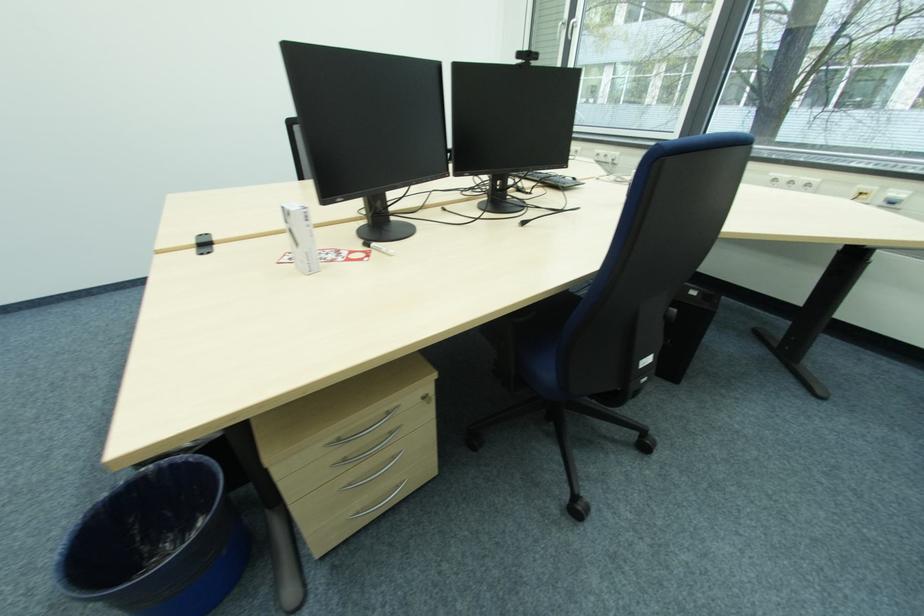
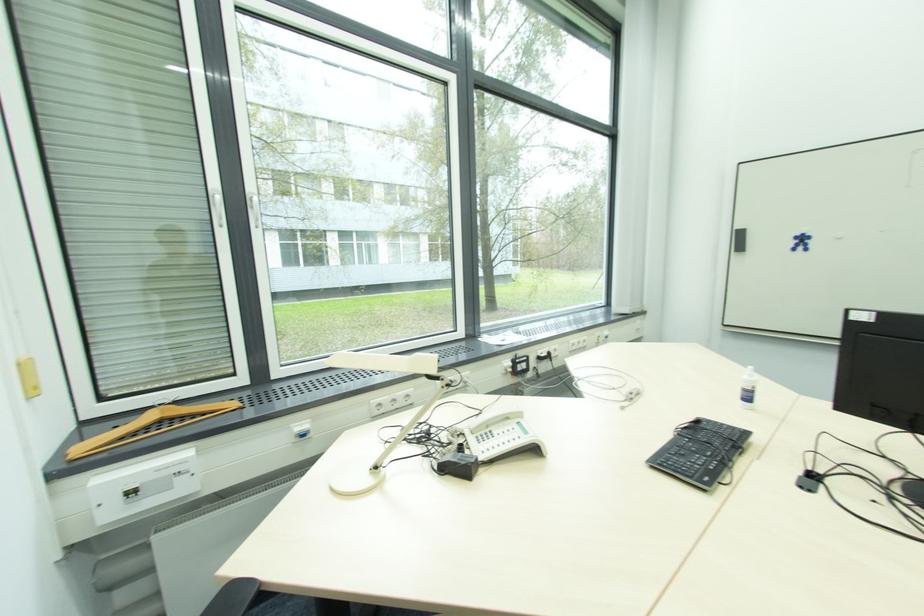
Locate, in the second image, the point that corresponds to pixel 577 180 in the first image.

(700, 424)